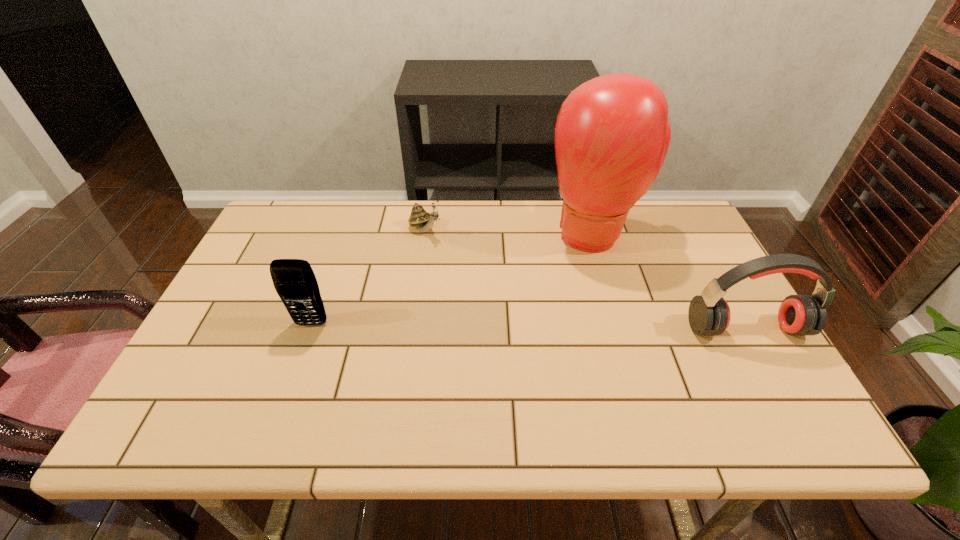
In the image, there is a desktop. Identify the location of vacant space at the near edge. (468, 364).

This screenshot has width=960, height=540. Identify the location of free region at the left edge of the desktop. (252, 298).

Where is `vacant space at the right edge of the desktop`? vacant space at the right edge of the desktop is located at coordinates (681, 265).

In the image, there is a desktop. At what (x,y) coordinates should I click in order to perform the action: click on vacant space at the far left corner. Please return your answer as a coordinate pair (x, y). Looking at the image, I should click on (274, 208).

In the image, there is a desktop. Find the location of `vacant space at the far right corner`. vacant space at the far right corner is located at coordinates (678, 227).

Locate an element on the screen. Image resolution: width=960 pixels, height=540 pixels. vacant point located between the shortest object and the second object from right to left is located at coordinates point(510,232).

Where is `vacant area that lies between the rightmost object and the shortest object`? Image resolution: width=960 pixels, height=540 pixels. vacant area that lies between the rightmost object and the shortest object is located at coordinates (586, 280).

Find the location of a particular element. The width and height of the screenshot is (960, 540). free space between the second object from right to left and the earphone is located at coordinates (670, 281).

Locate an element on the screen. free space between the third object from left to right and the cellular telephone is located at coordinates (452, 279).

At what (x,y) coordinates should I click in order to perform the action: click on vacant point located between the cellular telephone and the shortest object. Please return your answer as a coordinate pair (x, y). Looking at the image, I should click on (369, 277).